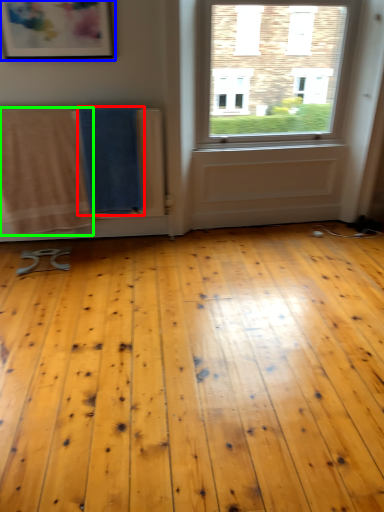
Question: Which object is positioned closest to beach towel (highlighted by a red box)? Select from picture frame (highlighted by a blue box) and beach towel (highlighted by a green box).

Choices:
 (A) picture frame
 (B) beach towel

Answer: (B)